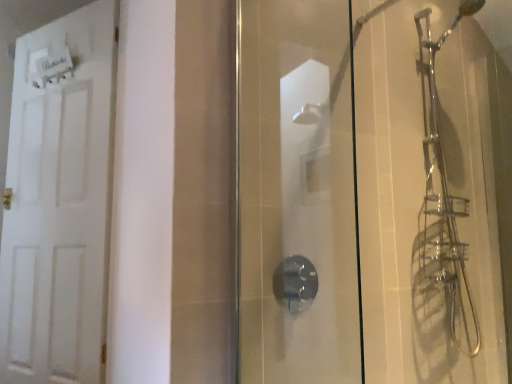
Measure the distance between point (71,308) and camera.

The depth of point (71,308) is 6.34 feet.

The width and height of the screenshot is (512, 384). Describe the element at coordinates (58, 201) in the screenshot. I see `white matte door at left` at that location.

From the picture: Measure the distance between white matte door at left and camera.

white matte door at left is 1.78 meters from camera.

I want to click on white matte door at left, so click(58, 201).

What do you see at coordinates (296, 194) in the screenshot?
I see `transparent glass shower door at center` at bounding box center [296, 194].

Locate an element on the screen. This screenshot has height=384, width=512. transparent glass shower door at center is located at coordinates (296, 194).

This screenshot has width=512, height=384. In order to click on white matte door at left in this screenshot , I will do `click(58, 201)`.

Does transparent glass shower door at center appear on the left side of white matte door at left?

Incorrect, transparent glass shower door at center is not on the left side of white matte door at left.

Which object is closer to the camera, transparent glass shower door at center or white matte door at left?

Positioned in front is transparent glass shower door at center.

Is point (277, 373) farther from camera compared to point (87, 216)?

No, (277, 373) is in front of (87, 216).

From the image's perspective, is transparent glass shower door at center on white matte door at left?

No, from the image's perspective, transparent glass shower door at center is not on top of white matte door at left.

From a real-world perspective, who is located lower, transparent glass shower door at center or white matte door at left?

transparent glass shower door at center is physically lower.

Between transparent glass shower door at center and white matte door at left, which one has larger width?

white matte door at left.

Can you confirm if transparent glass shower door at center is shorter than white matte door at left?

Yes, transparent glass shower door at center is shorter than white matte door at left.

Is transparent glass shower door at center bigger or smaller than white matte door at left?

Considering their sizes, transparent glass shower door at center takes up less space than white matte door at left.

Is transparent glass shower door at center inside or outside of white matte door at left?

transparent glass shower door at center is spatially situated outside white matte door at left.

Are transparent glass shower door at center and white matte door at left located far from each other?

That's right, there is a large distance between transparent glass shower door at center and white matte door at left.

Does transparent glass shower door at center turn towards white matte door at left?

No, transparent glass shower door at center is not facing towards white matte door at left.

This screenshot has height=384, width=512. I want to click on screen door lying in front of the white matte door at left, so click(x=296, y=194).

Is white matte door at left to the left or to the right of transparent glass shower door at center in the image?

white matte door at left is to the left of transparent glass shower door at center.

Is white matte door at left positioned behind transparent glass shower door at center?

Yes, it is.

Is point (94, 230) positioned in front of point (289, 137)?

No.

Looking at this image, from the image's perspective, would you say white matte door at left is shown under transparent glass shower door at center?

No, from the image's perspective, white matte door at left is not beneath transparent glass shower door at center.

From a real-world perspective, is white matte door at left over transparent glass shower door at center?

Correct, in the physical world, white matte door at left is higher than transparent glass shower door at center.

Considering the relative sizes of white matte door at left and transparent glass shower door at center in the image provided, is white matte door at left thinner than transparent glass shower door at center?

No, white matte door at left is not thinner than transparent glass shower door at center.

Can you confirm if white matte door at left is shorter than transparent glass shower door at center?

In fact, white matte door at left may be taller than transparent glass shower door at center.

Consider the image. Looking at the image, does white matte door at left seem bigger or smaller compared to transparent glass shower door at center?

In the image, white matte door at left appears to be larger than transparent glass shower door at center.

Based on the photo, would you say white matte door at left is outside transparent glass shower door at center?

white matte door at left is positioned outside transparent glass shower door at center.

Are white matte door at left and transparent glass shower door at center located far from each other?

Indeed, white matte door at left is not near transparent glass shower door at center.

Is white matte door at left looking in the opposite direction of transparent glass shower door at center?

No, white matte door at left is not facing away from transparent glass shower door at center.

How different are the orientations of white matte door at left and transparent glass shower door at center in degrees?

The angular difference between white matte door at left and transparent glass shower door at center is 87.8 degrees.

How distant is white matte door at left from transparent glass shower door at center?

A distance of 1.04 meters exists between white matte door at left and transparent glass shower door at center.

You are a GUI agent. You are given a task and a screenshot of the screen. Output one action in this format:
    pyautogui.click(x=<x>, y=<y>)
    Task: Click on the door behind the transparent glass shower door at center
    
    Given the screenshot: What is the action you would take?
    pyautogui.click(x=58, y=201)

In the image, there is a transparent glass shower door at center. At what (x,y) coordinates should I click in order to perform the action: click on door above it (from the image's perspective). Please return your answer as a coordinate pair (x, y). Image resolution: width=512 pixels, height=384 pixels. Looking at the image, I should click on (58, 201).

Find the location of a particular element. door on the left of the transparent glass shower door at center is located at coordinates (58, 201).